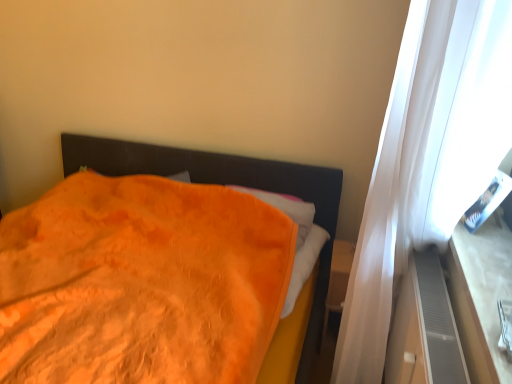
In order to click on free spot above gray textured dresser at right (from a real-world perspective) in this screenshot , I will do `click(443, 312)`.